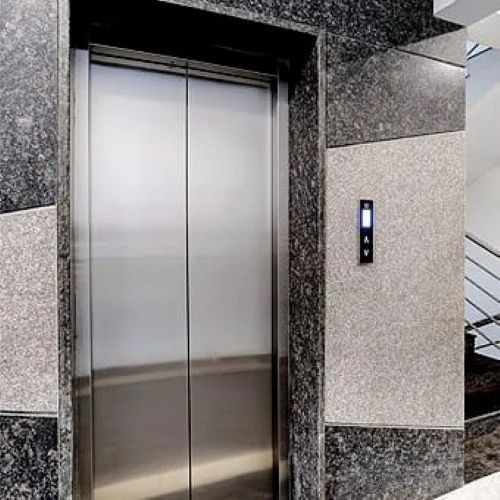
Find the location of a particular element. black granite wall is located at coordinates (363, 476).